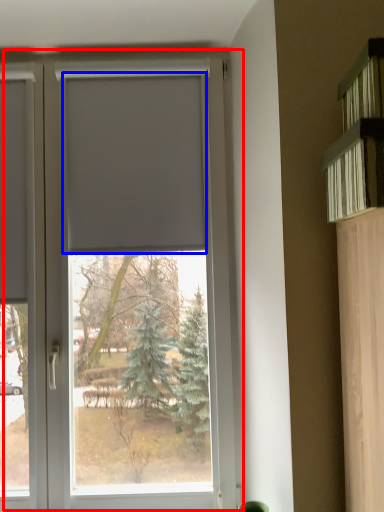
Question: Which point is closer to the camera, window (highlighted by a red box) or blind (highlighted by a blue box)?

Choices:
 (A) window
 (B) blind

Answer: (A)